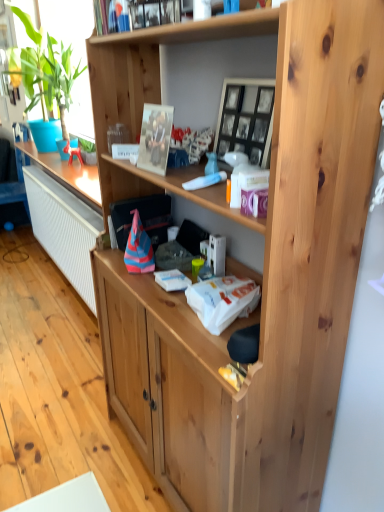
Question: Is metallic silver photo frame at upper center taller or shorter than metallic silver picture frame at upper center, the 2th picture frame in the right-to-left sequence?

Choices:
 (A) tall
 (B) short

Answer: (B)

Question: Does point (130, 22) appear closer or farther from the camera than point (155, 140)?

Choices:
 (A) farther
 (B) closer

Answer: (B)

Question: Estimate the real-world distances between objects in this image. Which object is closer to the black glass picture frame at upper center, which is the 1th picture frame from right to left?

Choices:
 (A) metallic silver photo frame at upper center
 (B) green leafy plant at left
 (C) metallic silver picture frame at upper center, the 2th picture frame in the right-to-left sequence

Answer: (C)

Question: Which object is the closest to the black glass picture frame at upper center, which is the 1th picture frame from right to left?

Choices:
 (A) green leafy plant at left
 (B) metallic silver picture frame at upper center, the 2th picture frame in the right-to-left sequence
 (C) metallic silver photo frame at upper center

Answer: (B)